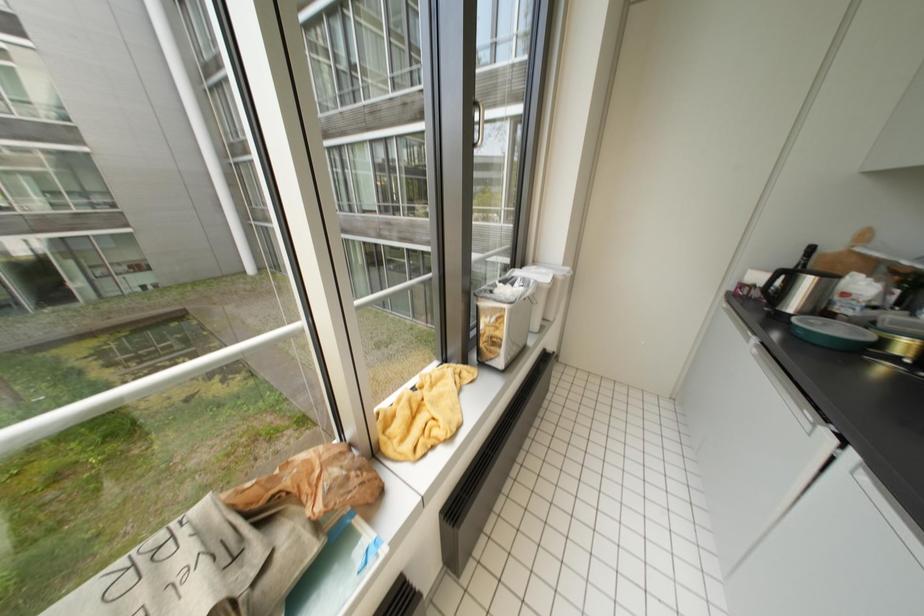
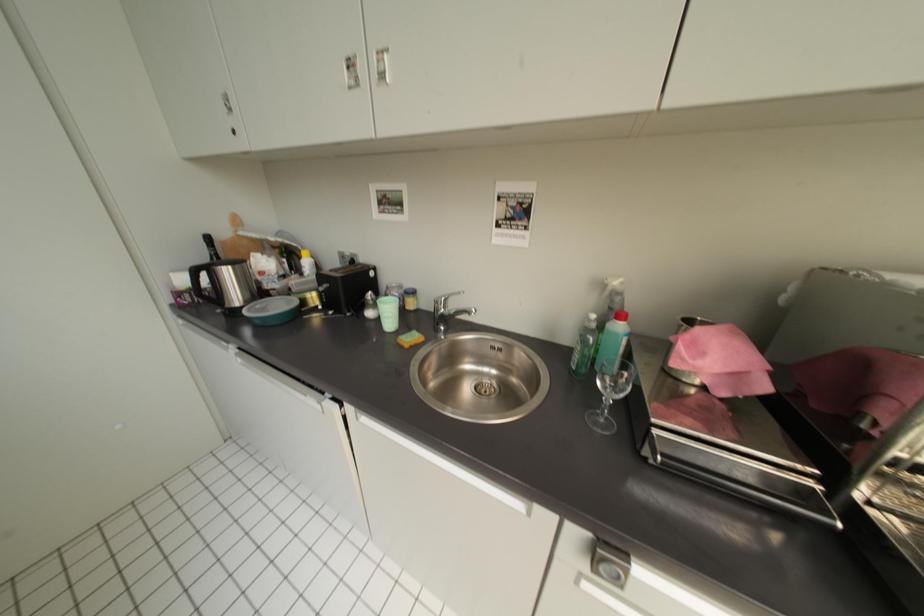
Based on the continuous images, in which direction is the camera rotating?

The camera rotated toward right-down.